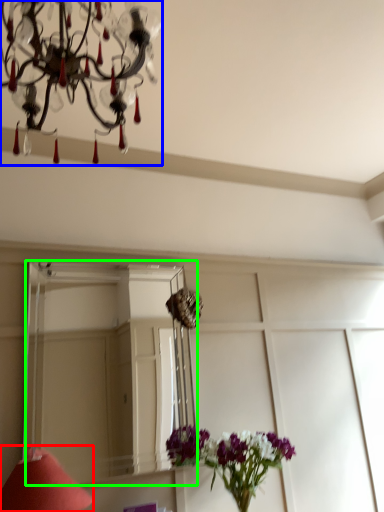
Question: Which is farther away from table lamp (highlighted by a red box)? lamp (highlighted by a blue box) or mirror (highlighted by a green box)?

Choices:
 (A) lamp
 (B) mirror

Answer: (B)